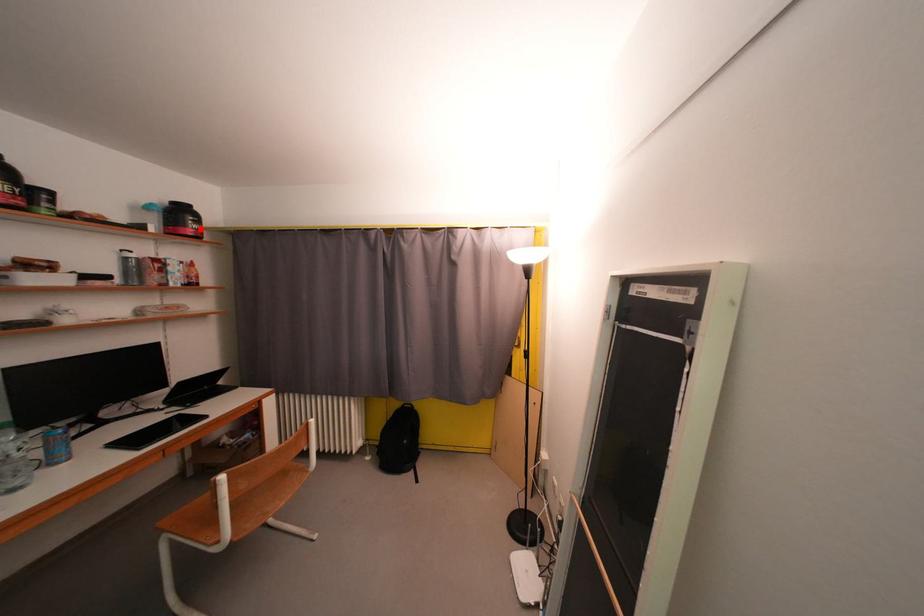
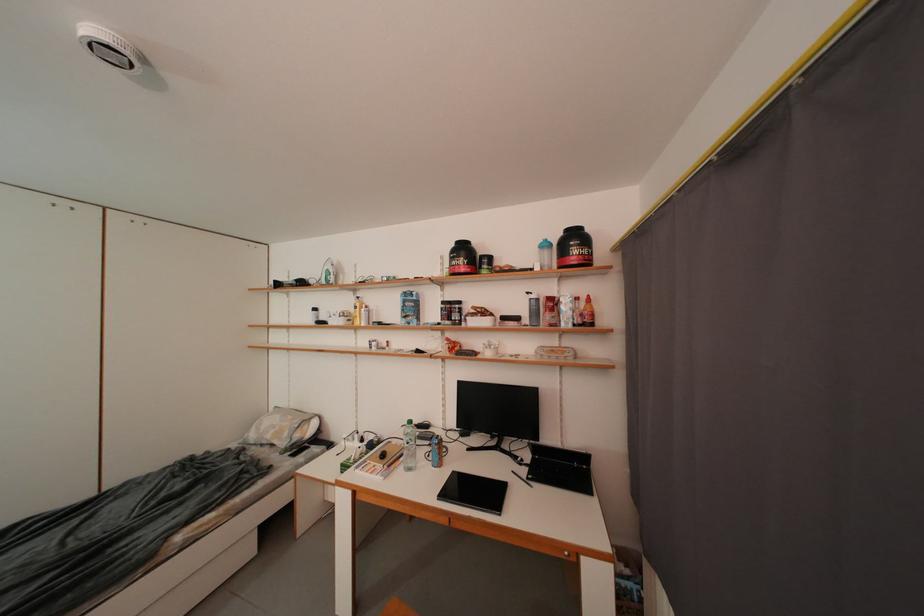
In the second image, find the point that corresponds to the highlighted location in the first image.

(582, 254)